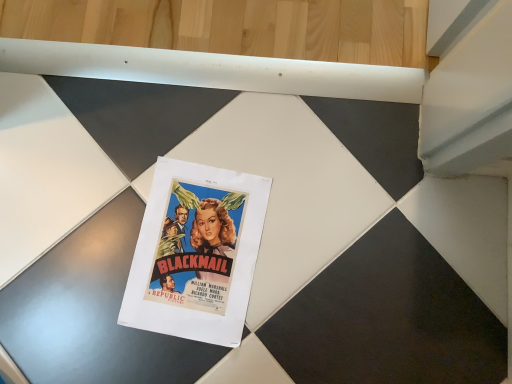
At what (x,y) coordinates should I click in order to perform the action: click on matte paper poster at center. Please return your answer as a coordinate pair (x, y). Image resolution: width=512 pixels, height=384 pixels. Looking at the image, I should click on (196, 253).

The height and width of the screenshot is (384, 512). Describe the element at coordinates (196, 253) in the screenshot. I see `matte paper poster at center` at that location.

Measure the distance between matte paper poster at center and camera.

matte paper poster at center and camera are 28.25 inches apart.

The width and height of the screenshot is (512, 384). I want to click on matte paper poster at center, so click(196, 253).